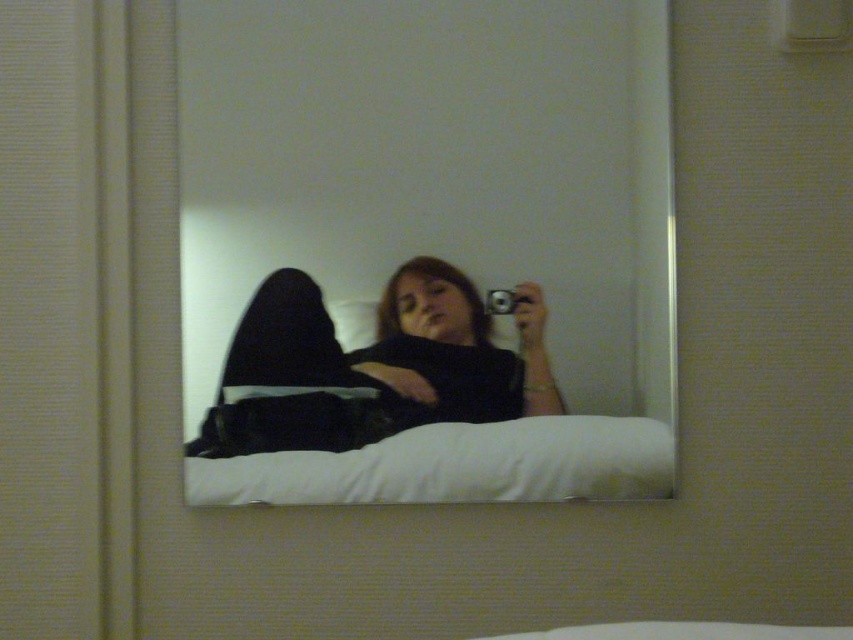
Question: Among these points, which one is nearest to the camera?

Choices:
 (A) (393, 445)
 (B) (558, 112)

Answer: (B)

Question: Does black matte pants at center have a lesser width compared to white soft pillow at center?

Choices:
 (A) yes
 (B) no

Answer: (A)

Question: Among these objects, which one is farthest from the camera?

Choices:
 (A) black matte pants at center
 (B) clear glass mirror at upper center

Answer: (A)

Question: Where is clear glass mirror at upper center located in relation to black matte pants at center in the image?

Choices:
 (A) below
 (B) above

Answer: (B)

Question: Can you confirm if clear glass mirror at upper center is thinner than black matte pants at center?

Choices:
 (A) no
 (B) yes

Answer: (A)

Question: Which object is positioned closest to the black matte pants at center?

Choices:
 (A) clear glass mirror at upper center
 (B) white soft pillow at center

Answer: (B)